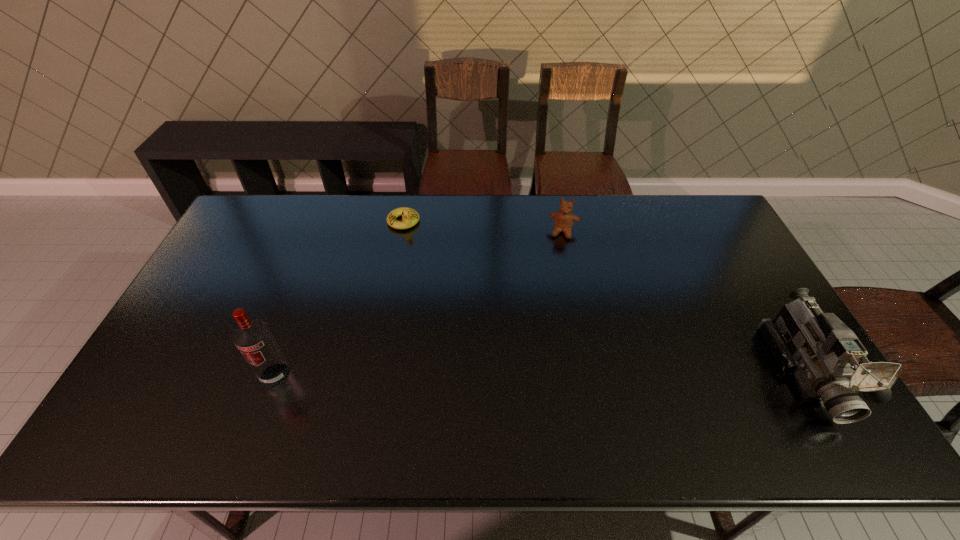
What are the coordinates of `vodka` in the screenshot? It's located at (253, 338).

This screenshot has height=540, width=960. Identify the location of the tallest object. (253, 338).

This screenshot has width=960, height=540. In order to click on the rightmost object in this screenshot , I will do `click(828, 360)`.

Find the location of `the second tallest object`. the second tallest object is located at coordinates (828, 360).

Identify the location of duckling. The width and height of the screenshot is (960, 540). (410, 217).

What are the coordinates of `the second object from left to right` in the screenshot? It's located at (410, 217).

Where is `teddy bear`? This screenshot has height=540, width=960. teddy bear is located at coordinates (564, 219).

The image size is (960, 540). In order to click on the second object from right to left in this screenshot , I will do `click(564, 219)`.

Where is `vacant space located on the front label of the vodka`? The height and width of the screenshot is (540, 960). vacant space located on the front label of the vodka is located at coordinates (264, 407).

Where is `vacant point located 0.200m on the face of the second object from left to right`? The image size is (960, 540). vacant point located 0.200m on the face of the second object from left to right is located at coordinates (429, 268).